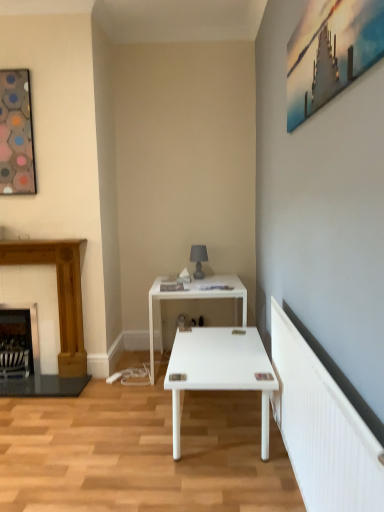
Locate an element on the screen. The width and height of the screenshot is (384, 512). free spot to the right of wooden fireplace at left, arranged as the 2th fireplace when viewed from the left is located at coordinates (122, 375).